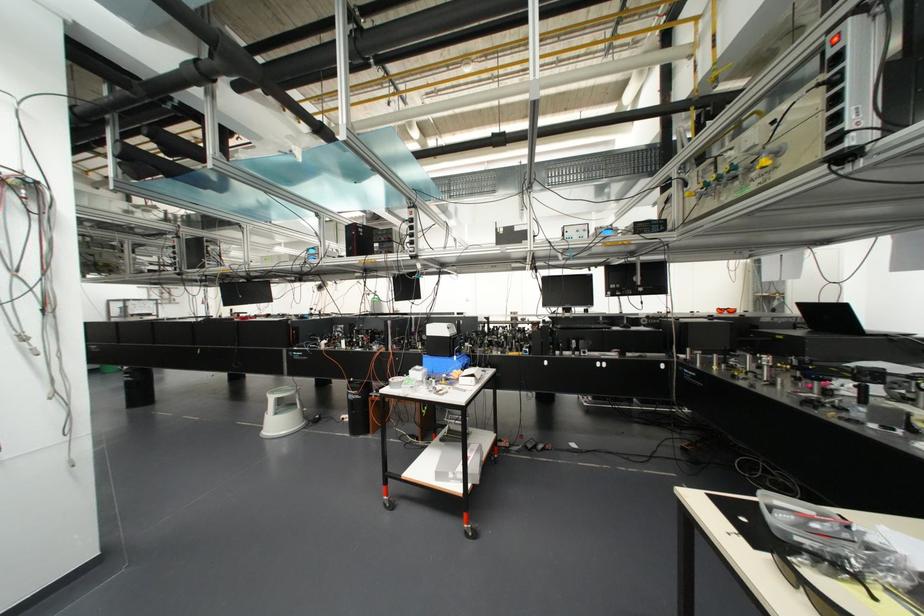
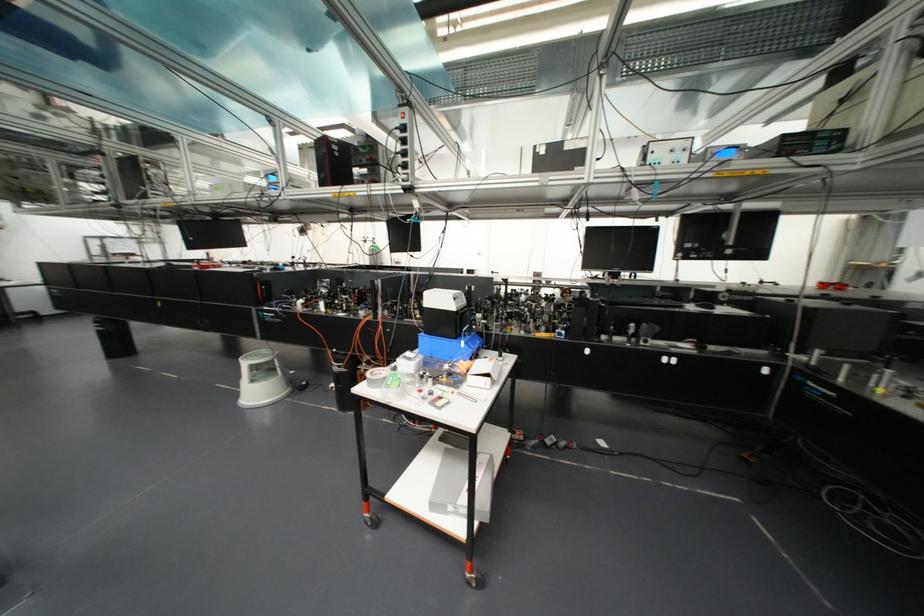
Find the pixel in the second image that matches (x=471, y=375) in the first image.

(487, 374)